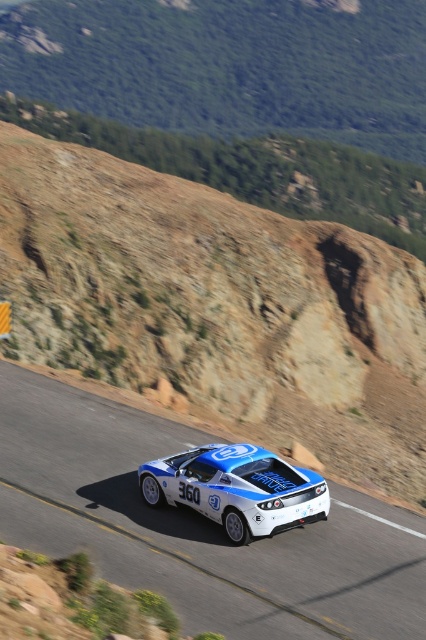
You are a race car driver preparing to take a sharp left turn on a mountain road. You see the white glossy asphalt at center and the shiny blue racing car at center. Which object is located to the left of the other?

The white glossy asphalt at center is positioned on the left side of shiny blue racing car at center, so the white glossy asphalt at center is to the left of the shiny blue racing car at center.